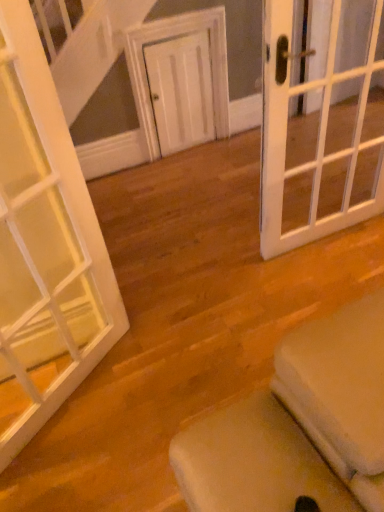
You are a GUI agent. You are given a task and a screenshot of the screen. Output one action in this format:
    pyautogui.click(x=<x>, y=<y>)
    Task: Click on the vacant area that lies to the right of white matte door at center, placed as the 2th door when sorted from left to right
    The width and height of the screenshot is (384, 512).
    Given the screenshot: What is the action you would take?
    pyautogui.click(x=227, y=147)